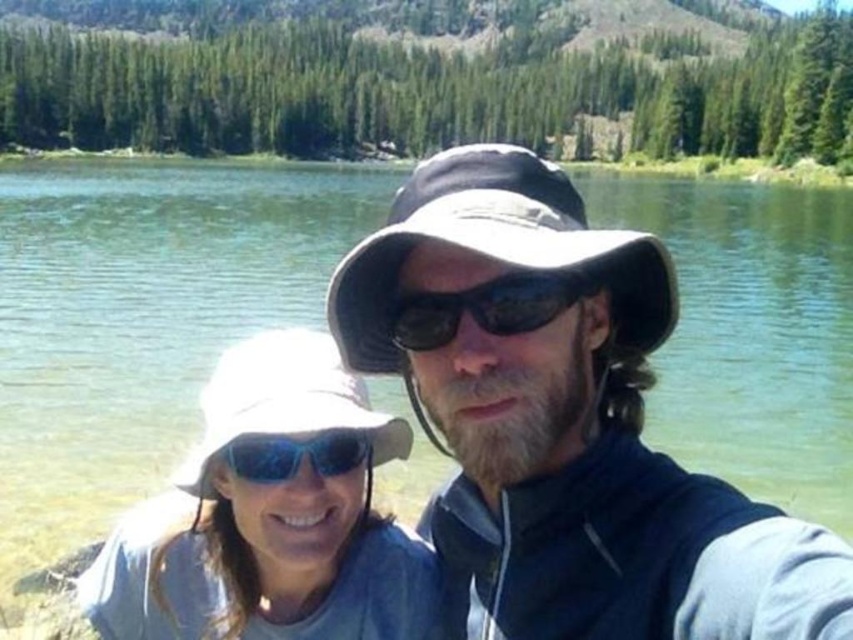
Question: Considering the relative positions of matte black hat at center and white matte hat at center in the image provided, where is matte black hat at center located with respect to white matte hat at center?

Choices:
 (A) left
 (B) right

Answer: (B)

Question: Among these objects, which one is nearest to the camera?

Choices:
 (A) blue reflective lens goggles at center
 (B) white matte hat at center
 (C) matte black hat at center

Answer: (C)

Question: Does matte black hat at center appear on the right side of white matte hat at center?

Choices:
 (A) no
 (B) yes

Answer: (B)

Question: Which object appears farthest from the camera in this image?

Choices:
 (A) sunglasses at center
 (B) matte black hat at center
 (C) white matte hat at center

Answer: (A)

Question: Based on their relative distances, which object is nearer to the matte black hat at center?

Choices:
 (A) white matte hat at center
 (B) blue reflective lens goggles at center

Answer: (B)

Question: Where is white matte hat at center located in relation to sunglasses at center in the image?

Choices:
 (A) below
 (B) above

Answer: (A)